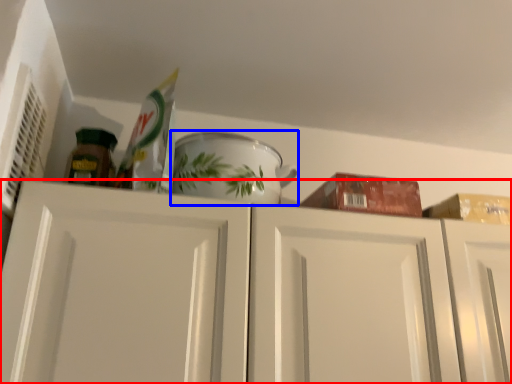
Question: Which of the following is the farthest to the observer, cabinetry (highlighted by a red box) or tableware (highlighted by a blue box)?

Choices:
 (A) cabinetry
 (B) tableware

Answer: (B)